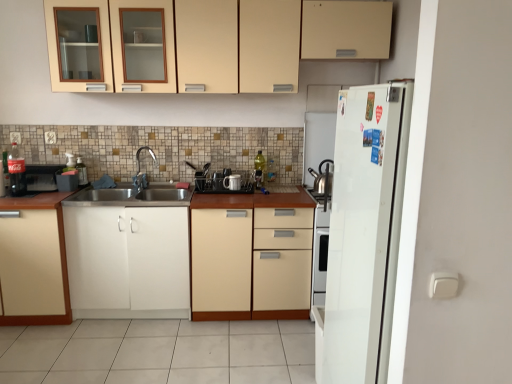
The image size is (512, 384). I want to click on empty space that is ontop of white tile at lower center, so click(140, 349).